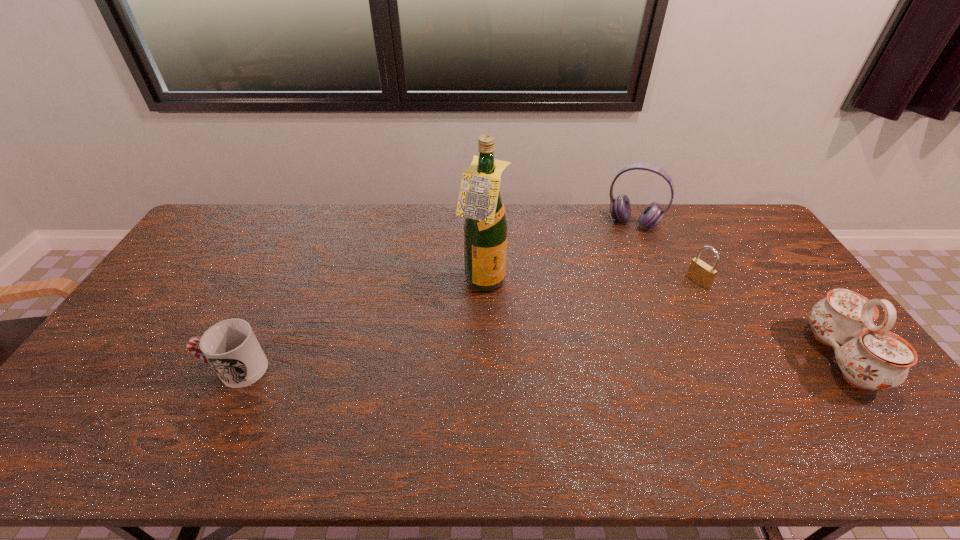
Where is `vacant space on the desktop that is between the cup and the rightmost object and is positioned on the headband and ear cups of the farthest object`? The width and height of the screenshot is (960, 540). vacant space on the desktop that is between the cup and the rightmost object and is positioned on the headband and ear cups of the farthest object is located at coordinates (577, 362).

You are a GUI agent. You are given a task and a screenshot of the screen. Output one action in this format:
    pyautogui.click(x=<x>, y=<y>)
    Task: Click on the free spot on the desktop that is between the cup and the chinaware and is positioned on the front-facing side of the padlock
    
    Given the screenshot: What is the action you would take?
    pyautogui.click(x=549, y=363)

Locate an element on the screen. free space on the desktop that is between the leftmost object and the rightmost object and is positioned on the front-facing side of the liquor is located at coordinates (623, 361).